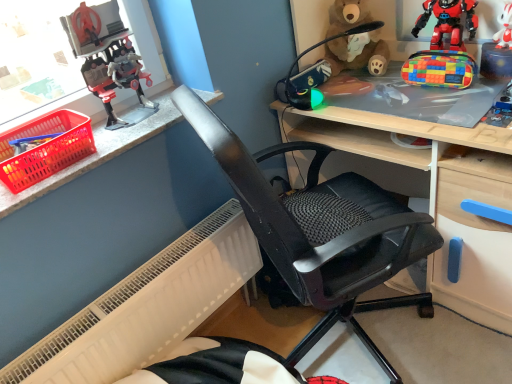
Where is `free point in front of multicolored fabric pencil case at upper right, which is the 3th toy from left to right`? free point in front of multicolored fabric pencil case at upper right, which is the 3th toy from left to right is located at coordinates (451, 106).